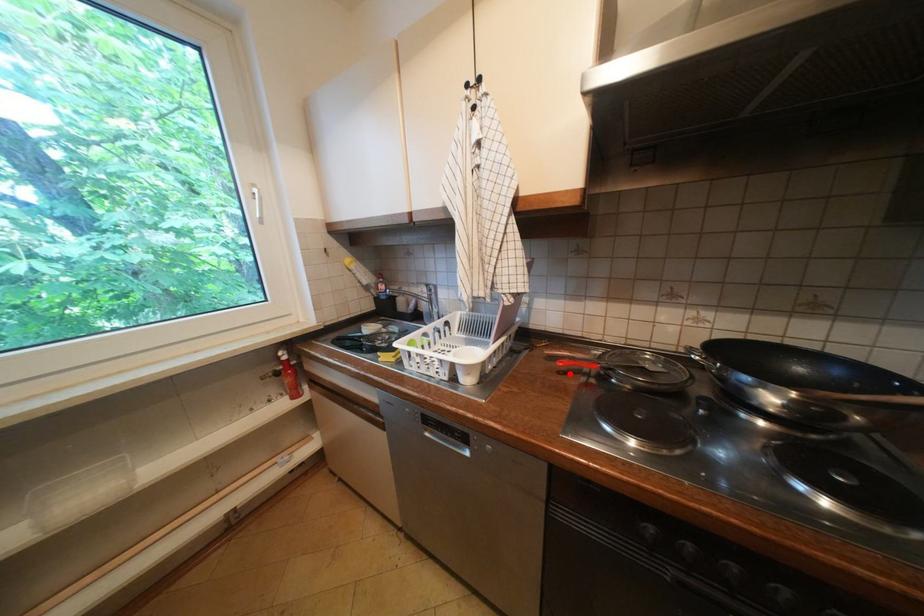
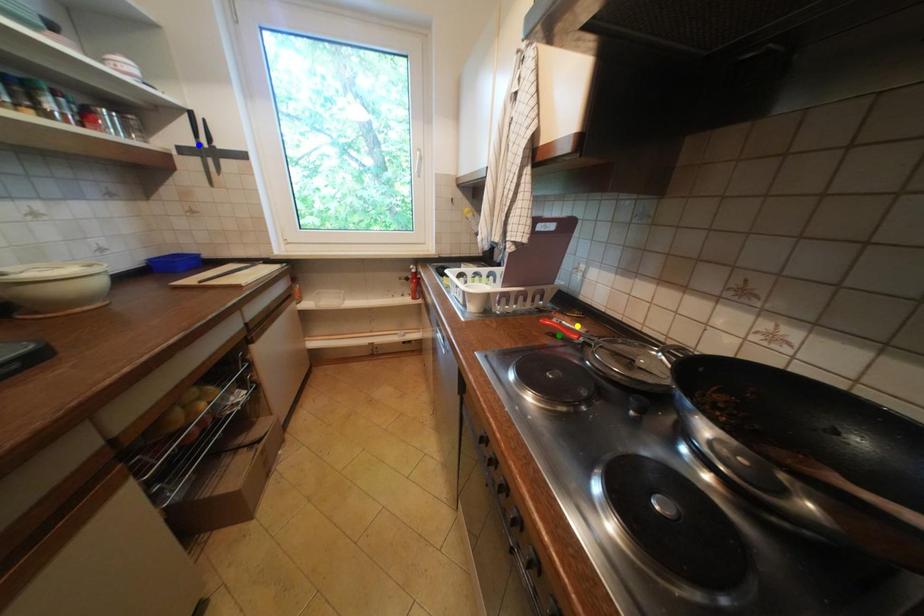
Question: I am providing you with two images of the same scene from different viewpoints. A red point is marked on the first image. You are given multiple points on the second image. In image 2, which mark is for the same physical point as the one in image 1?

Choices:
 (A) blue point
 (B) yellow point
 (C) green point

Answer: (C)